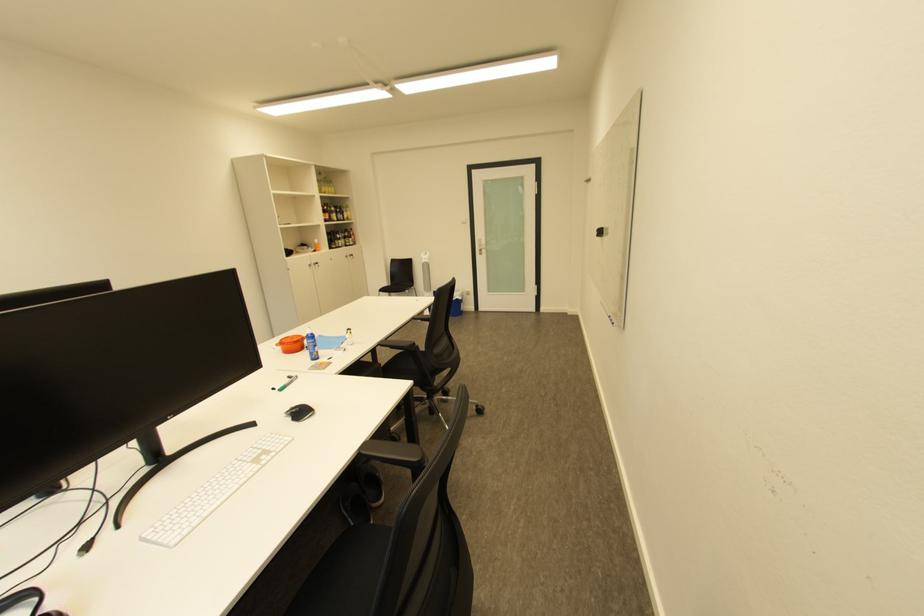
The image size is (924, 616). Describe the element at coordinates (360, 557) in the screenshot. I see `a chair sitting surface` at that location.